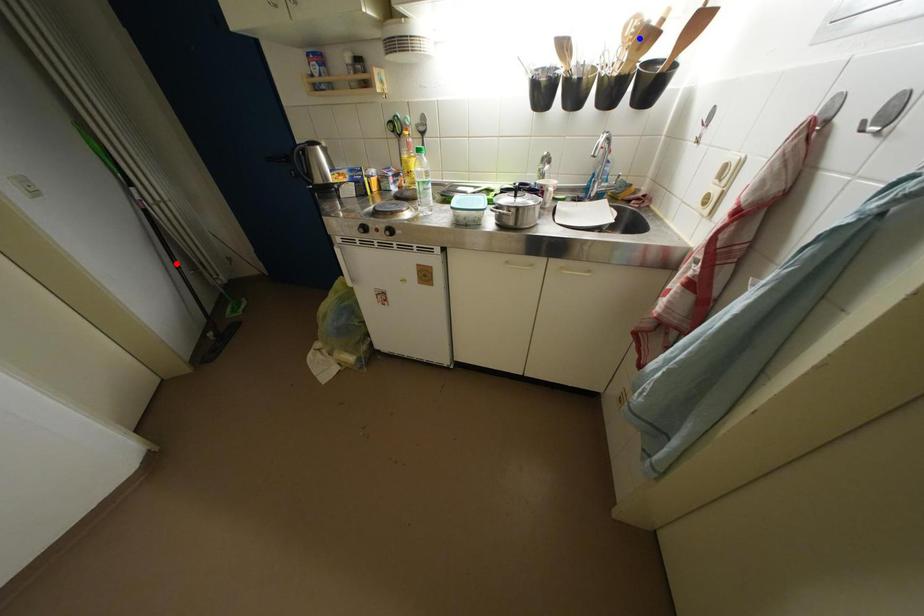
Question: In the image, two points are highlighted. Which point is nearer to the camera? Reply with the corresponding letter.

Choices:
 (A) blue point
 (B) red point

Answer: (A)